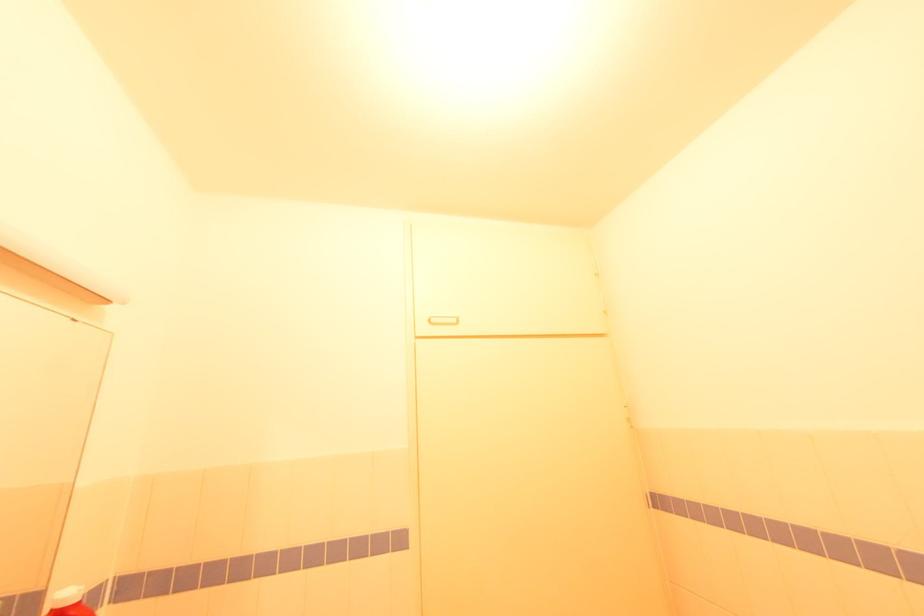
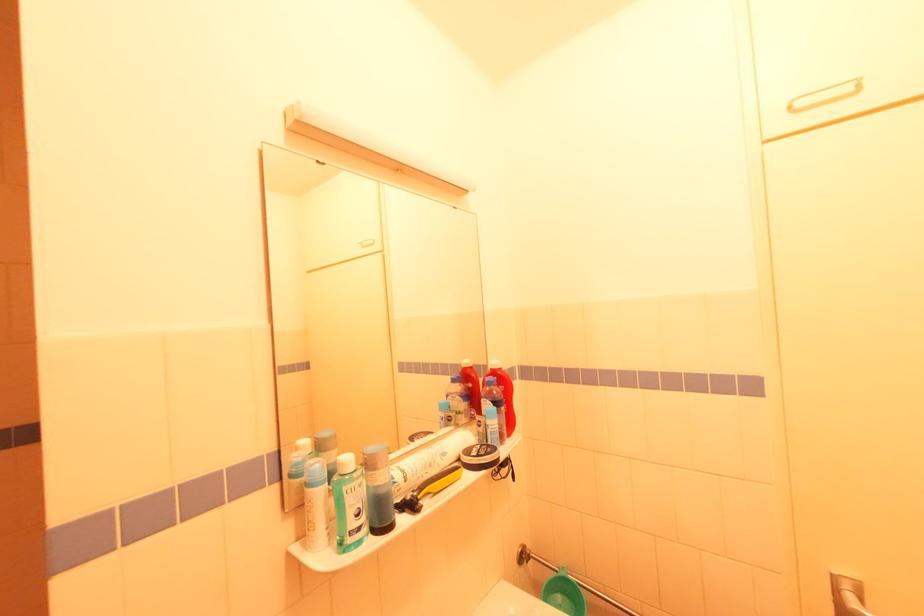
Question: The first image is from the beginning of the video and the second image is from the end. How did the camera likely rotate when shooting the video?

Choices:
 (A) Left
 (B) Right
 (C) Up
 (D) Down

Answer: (A)